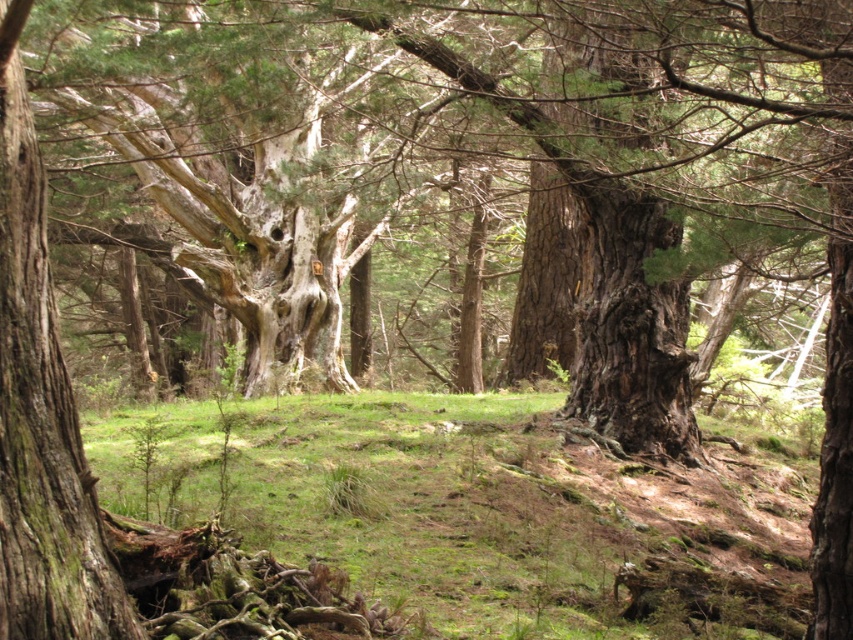
Question: Which object is farther from the camera taking this photo?

Choices:
 (A) smooth bark tree trunk at center
 (B) green mossy ground at center

Answer: (B)

Question: Which of the following is the farthest from the observer?

Choices:
 (A) green mossy ground at center
 (B) smooth bark tree trunk at center

Answer: (A)

Question: Is green mossy ground at center positioned in front of smooth bark tree trunk at center?

Choices:
 (A) yes
 (B) no

Answer: (B)

Question: Can you confirm if green mossy ground at center is positioned below smooth bark tree trunk at center?

Choices:
 (A) yes
 (B) no

Answer: (A)

Question: Is green mossy ground at center positioned at the back of smooth bark tree trunk at center?

Choices:
 (A) yes
 (B) no

Answer: (A)